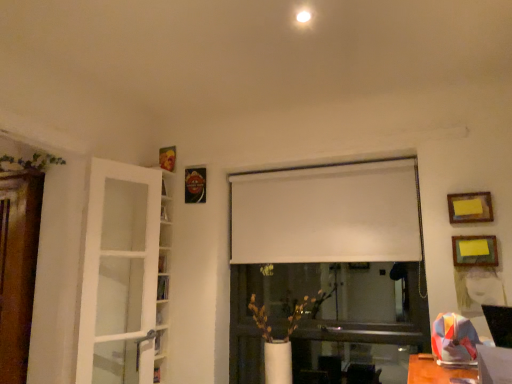
The width and height of the screenshot is (512, 384). Describe the element at coordinates (29, 162) in the screenshot. I see `green leafy plant at upper left, acting as the second plant starting from the bottom` at that location.

Image resolution: width=512 pixels, height=384 pixels. What do you see at coordinates (475, 251) in the screenshot?
I see `yellow paper at upper right, which is the 1th picture frame from bottom to top` at bounding box center [475, 251].

Identify the location of green leafy plant at upper left, acting as the second plant starting from the bottom. The image size is (512, 384). pyautogui.click(x=29, y=162).

Is yellow paper at upper right, which is the 1th picture frame from bottom to top, thinner than yellow paper at upper right, which ranks as the 2th picture frame in bottom-to-top order?

No.

Which is behind, point (487, 249) or point (483, 218)?

Positioned behind is point (483, 218).

Is yellow paper at upper right, arranged as the 2th picture frame when viewed from the top, touching yellow paper at upper right, which ranks as the 2th picture frame in bottom-to-top order?

No, yellow paper at upper right, arranged as the 2th picture frame when viewed from the top, is not with yellow paper at upper right, which ranks as the 2th picture frame in bottom-to-top order.

Are yellow paper at upper right, arranged as the 2th picture frame when viewed from the top, and white glass door at left far apart?

yellow paper at upper right, arranged as the 2th picture frame when viewed from the top, is far away from white glass door at left.

Which object is further away from the camera taking this photo, yellow paper at upper right, which is the 1th picture frame from bottom to top, or white glass door at left?

yellow paper at upper right, which is the 1th picture frame from bottom to top.

Which is further, (459,263) or (153,357)?

The point (153,357) is more distant.

Considering the sizes of objects yellow paper at upper right, arranged as the 2th picture frame when viewed from the top, and white glass door at left in the image provided, who is taller, yellow paper at upper right, arranged as the 2th picture frame when viewed from the top, or white glass door at left?

white glass door at left is taller.

Is there a large distance between yellow paper at upper right, which ranks as the 2th picture frame in bottom-to-top order, and white glass door at left?

Absolutely, yellow paper at upper right, which ranks as the 2th picture frame in bottom-to-top order, is distant from white glass door at left.

Considering the sizes of yellow paper at upper right, which ranks as the 2th picture frame in bottom-to-top order, and white glass door at left in the image, is yellow paper at upper right, which ranks as the 2th picture frame in bottom-to-top order, bigger or smaller than white glass door at left?

Considering their sizes, yellow paper at upper right, which ranks as the 2th picture frame in bottom-to-top order, takes up less space than white glass door at left.

Which of these two, yellow paper at upper right, the 1th picture frame when ordered from top to bottom, or white glass door at left, is wider?

Wider between the two is white glass door at left.

Who is bigger, white matte curtain at center or green leafy plant at upper left, which ranks as the first plant in left-to-right order?

white matte curtain at center is bigger.

Does point (395, 230) come in front of point (47, 153)?

No, it is behind (47, 153).

In the scene shown: Would you say green leafy plant at upper left, positioned as the second plant in right-to-left order, is part of white matte curtain at center's contents?

Actually, green leafy plant at upper left, positioned as the second plant in right-to-left order, is outside white matte curtain at center.

Considering the sizes of white matte curtain at center and green leafy plant at upper left, which is the 1th plant in top-to-bottom order, in the image, is white matte curtain at center taller or shorter than green leafy plant at upper left, which is the 1th plant in top-to-bottom order,?

Considering their sizes, white matte curtain at center has more height than green leafy plant at upper left, which is the 1th plant in top-to-bottom order.

Is white matte curtain at center oriented towards white matte vase at center, which is the first plant in right-to-left order?

No.

From a real-world perspective, is white matte curtain at center physically located above or below white matte vase at center, arranged as the 2th plant when viewed from the top?

A: In terms of real-world spatial position, white matte curtain at center is above white matte vase at center, arranged as the 2th plant when viewed from the top.

Is white matte curtain at center next to white matte vase at center, the first plant in the bottom-to-top sequence?

No, white matte curtain at center is not next to white matte vase at center, the first plant in the bottom-to-top sequence.

Locate an element on the screen. the 1st plant counting from the left side of the white matte curtain at center is located at coordinates (304, 311).

From the image's perspective, is white matte vase at center, which is the first plant in right-to-left order, positioned above or below yellow paper at upper right, which is the 1th picture frame from bottom to top?

white matte vase at center, which is the first plant in right-to-left order, is below yellow paper at upper right, which is the 1th picture frame from bottom to top.

Who is taller, white matte vase at center, which is the first plant in right-to-left order, or yellow paper at upper right, which is the 1th picture frame from bottom to top?

white matte vase at center, which is the first plant in right-to-left order.

Is white matte vase at center, which is the first plant in right-to-left order, outside of yellow paper at upper right, which is the 1th picture frame from bottom to top?

Yes.

Considering the relative sizes of yellow paper at upper right, which is the 1th picture frame from bottom to top, and white matte vase at center, the first plant in the bottom-to-top sequence, in the image provided, is yellow paper at upper right, which is the 1th picture frame from bottom to top, thinner than white matte vase at center, the first plant in the bottom-to-top sequence,?

Yes, yellow paper at upper right, which is the 1th picture frame from bottom to top, is thinner than white matte vase at center, the first plant in the bottom-to-top sequence.

Would you say yellow paper at upper right, arranged as the 2th picture frame when viewed from the top, is a long distance from white matte vase at center, marked as the second plant in a left-to-right arrangement?

Yes, yellow paper at upper right, arranged as the 2th picture frame when viewed from the top, and white matte vase at center, marked as the second plant in a left-to-right arrangement, are quite far apart.

From the image's perspective, does yellow paper at upper right, arranged as the 2th picture frame when viewed from the top, appear higher than white matte vase at center, arranged as the 2th plant when viewed from the top?

Yes, from the image's perspective, yellow paper at upper right, arranged as the 2th picture frame when viewed from the top, is over white matte vase at center, arranged as the 2th plant when viewed from the top.

Does yellow paper at upper right, arranged as the 2th picture frame when viewed from the top, have a lesser height compared to white matte vase at center, which is the first plant in right-to-left order?

Correct, yellow paper at upper right, arranged as the 2th picture frame when viewed from the top, is not as tall as white matte vase at center, which is the first plant in right-to-left order.

There is a yellow paper at upper right, arranged as the 2th picture frame when viewed from the top. At what (x,y) coordinates should I click in order to perform the action: click on picture frame above it (from a real-world perspective). Please return your answer as a coordinate pair (x, y). Looking at the image, I should click on click(470, 207).

From the white glass door at left, count 2nd picture frame to the right and point to it. Please provide its 2D coordinates.

[(475, 251)]

When comparing their distances from yellow paper at upper right, the 1th picture frame when ordered from top to bottom, does white glass door at left or white matte curtain at center seem further?

white glass door at left lies further to yellow paper at upper right, the 1th picture frame when ordered from top to bottom, than the other object.

Which object lies further to the anchor point yellow paper at upper right, arranged as the 2th picture frame when viewed from the top, yellow paper at upper right, which ranks as the 2th picture frame in bottom-to-top order, or green leafy plant at upper left, which ranks as the first plant in left-to-right order?

green leafy plant at upper left, which ranks as the first plant in left-to-right order.

Which object lies nearer to the anchor point yellow paper at upper right, the 1th picture frame when ordered from top to bottom, white glass door at left or white matte vase at center, the first plant in the bottom-to-top sequence?

white matte vase at center, the first plant in the bottom-to-top sequence, is closer to yellow paper at upper right, the 1th picture frame when ordered from top to bottom.

Estimate the real-world distances between objects in this image. Which object is further from green leafy plant at upper left, acting as the second plant starting from the bottom, white glass door at left or white matte curtain at center?

Based on the image, white matte curtain at center appears to be further to green leafy plant at upper left, acting as the second plant starting from the bottom.

When comparing their distances from white matte vase at center, marked as the second plant in a left-to-right arrangement, does yellow paper at upper right, which is the 1th picture frame from bottom to top, or white glass door at left seem further?

yellow paper at upper right, which is the 1th picture frame from bottom to top, is further to white matte vase at center, marked as the second plant in a left-to-right arrangement.

Consider the image. From the image, which object appears to be nearer to yellow paper at upper right, the 1th picture frame when ordered from top to bottom, white matte vase at center, marked as the second plant in a left-to-right arrangement, or white glass door at left?

white matte vase at center, marked as the second plant in a left-to-right arrangement.

Which object lies further to the anchor point green leafy plant at upper left, which is the 1th plant in top-to-bottom order, white matte curtain at center or yellow paper at upper right, the 1th picture frame when ordered from top to bottom?

yellow paper at upper right, the 1th picture frame when ordered from top to bottom, is further to green leafy plant at upper left, which is the 1th plant in top-to-bottom order.

Based on their spatial positions, is green leafy plant at upper left, which ranks as the first plant in left-to-right order, or yellow paper at upper right, the 1th picture frame when ordered from top to bottom, further from white glass door at left?

yellow paper at upper right, the 1th picture frame when ordered from top to bottom, is positioned further to the anchor white glass door at left.

At what (x,y) coordinates should I click in order to perform the action: click on picture frame between white matte curtain at center and yellow paper at upper right, arranged as the 2th picture frame when viewed from the top. Please return your answer as a coordinate pair (x, y). This screenshot has height=384, width=512. Looking at the image, I should click on 470,207.

The height and width of the screenshot is (384, 512). I want to click on plant between green leafy plant at upper left, which ranks as the first plant in left-to-right order, and white matte curtain at center, so click(304, 311).

Find the location of a particular element. plant between white glass door at left and white matte curtain at center from left to right is located at coordinates (304, 311).

Locate an element on the screen. This screenshot has width=512, height=384. curtain between white glass door at left and yellow paper at upper right, the 1th picture frame when ordered from top to bottom is located at coordinates (326, 214).